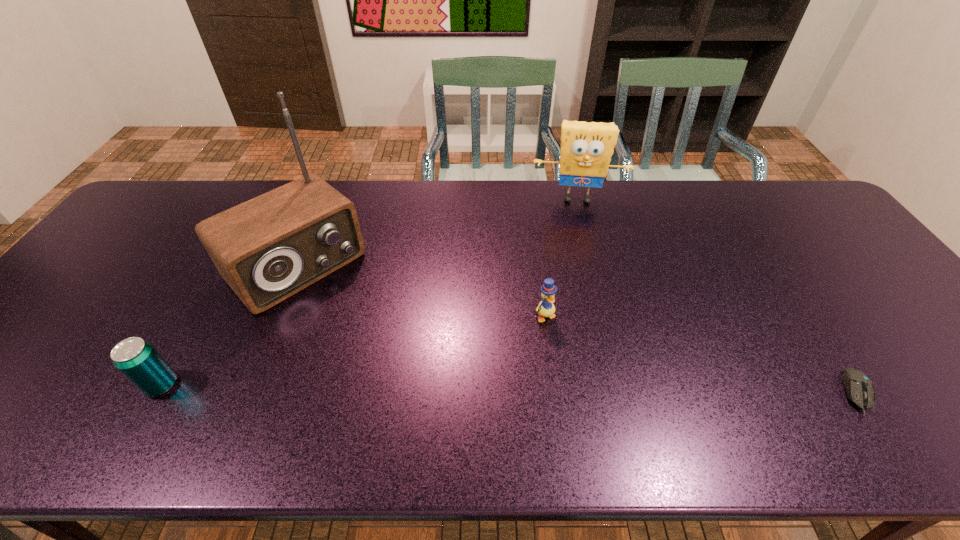
Where is `free space on the desktop that is between the beer can and the computer mouse and is positioned on the face of the farthest object`? This screenshot has width=960, height=540. free space on the desktop that is between the beer can and the computer mouse and is positioned on the face of the farthest object is located at coordinates (588, 390).

Identify the location of vacant space on the desktop that is between the beer can and the rightmost object and is positioned on the face of the duckling, where the monocle is placed. The height and width of the screenshot is (540, 960). (598, 390).

Find the location of a particular element. free spot on the desktop that is between the beer can and the computer mouse and is positioned on the front-facing side of the tallest object is located at coordinates (419, 388).